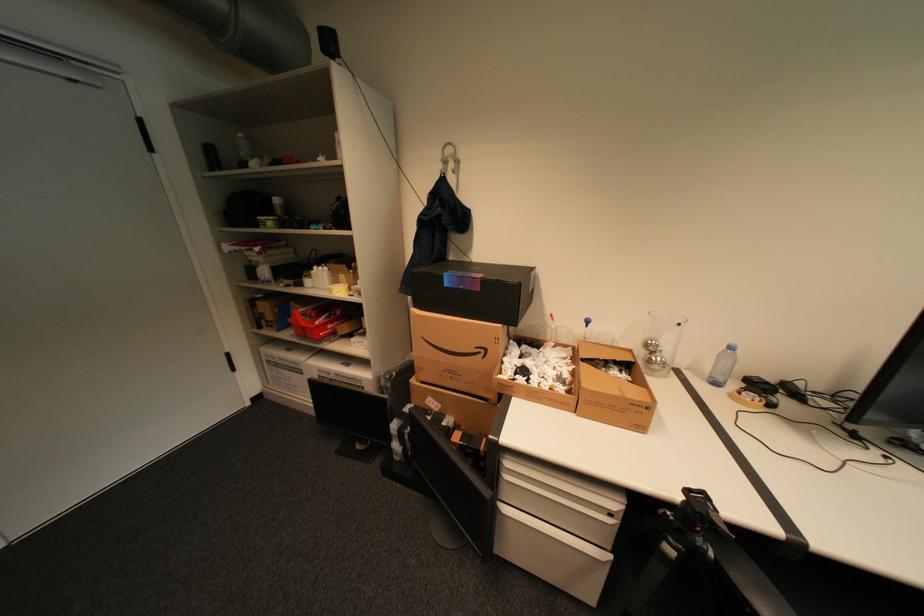
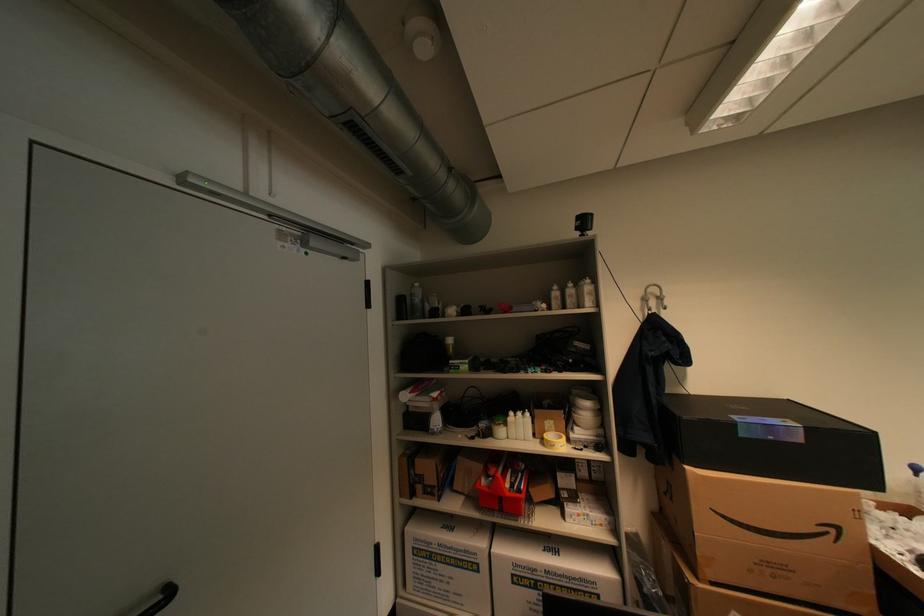
In the second image, find the point that corresponds to point 492,352 in the first image.

(841, 531)